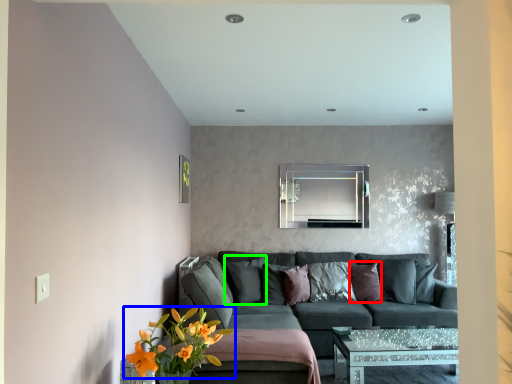
Question: Which is nearer to the pillow (highlighted by a red box)? flower (highlighted by a blue box) or pillow (highlighted by a green box).

Choices:
 (A) flower
 (B) pillow

Answer: (B)